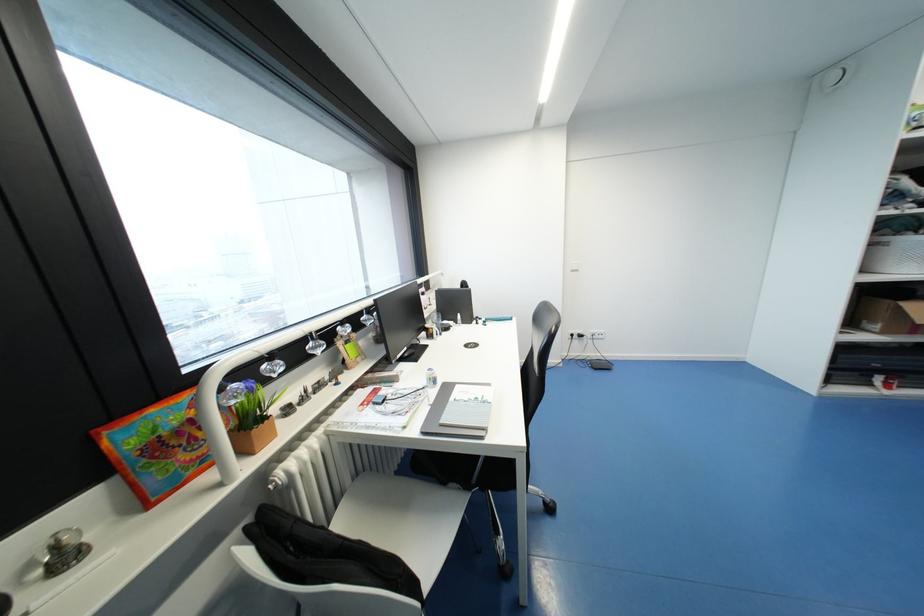
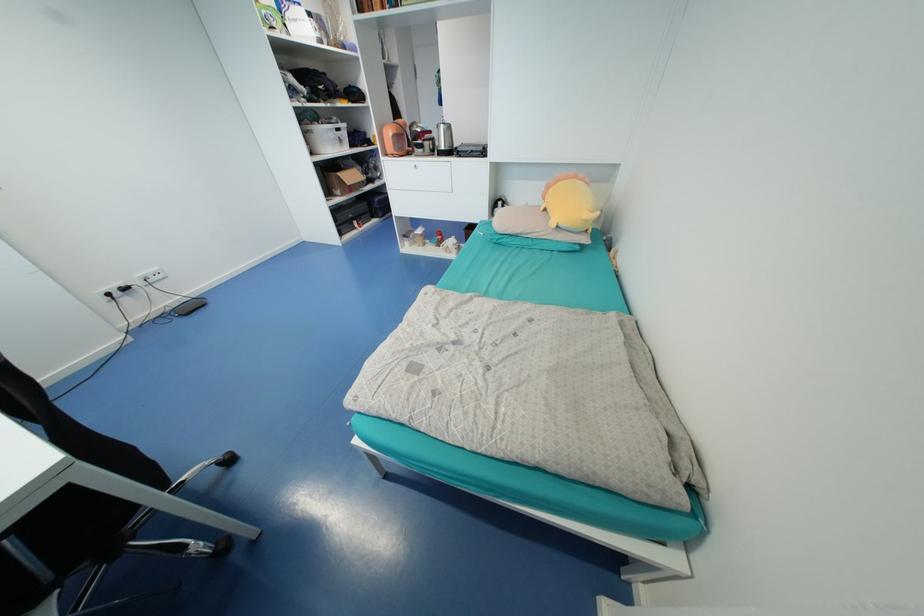
Locate, in the second image, the point that corresponds to [585,333] in the first image.

(125, 285)